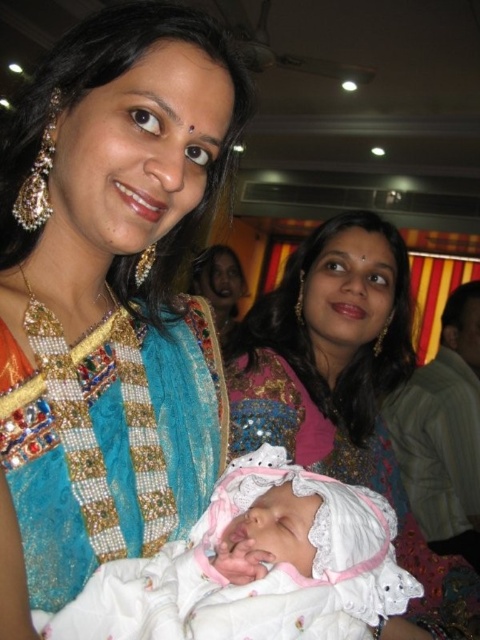
Can you confirm if matte pink fabric at center is positioned below white lace cloth at center?

Yes, matte pink fabric at center is below white lace cloth at center.

Does point (347, 241) come in front of point (101, 580)?

No, (347, 241) is behind (101, 580).

Find the location of `matte pink fabric at center`. matte pink fabric at center is located at coordinates (345, 390).

Does matte blue fabric at center have a larger size compared to matte gold necklace at center?

Actually, matte blue fabric at center might be smaller than matte gold necklace at center.

Who is lower down, matte blue fabric at center or matte gold necklace at center?

matte blue fabric at center is below.

The image size is (480, 640). I want to click on matte blue fabric at center, so click(x=108, y=298).

Which of these two, turquoise beaded fabric dress at center or matte pink fabric at center, stands shorter?

turquoise beaded fabric dress at center is shorter.

Does turquoise beaded fabric dress at center have a greater width compared to matte pink fabric at center?

No, turquoise beaded fabric dress at center is not wider than matte pink fabric at center.

Does point (196, 465) come in front of point (452, 595)?

Yes, point (196, 465) is in front of point (452, 595).

Where is `turquoise beaded fabric dress at center`? The height and width of the screenshot is (640, 480). turquoise beaded fabric dress at center is located at coordinates (108, 440).